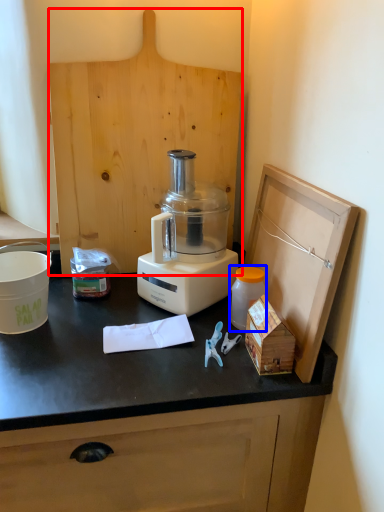
Question: Which of the following is the farthest to the observer, wood (highlighted by a red box) or bottle (highlighted by a blue box)?

Choices:
 (A) wood
 (B) bottle

Answer: (A)